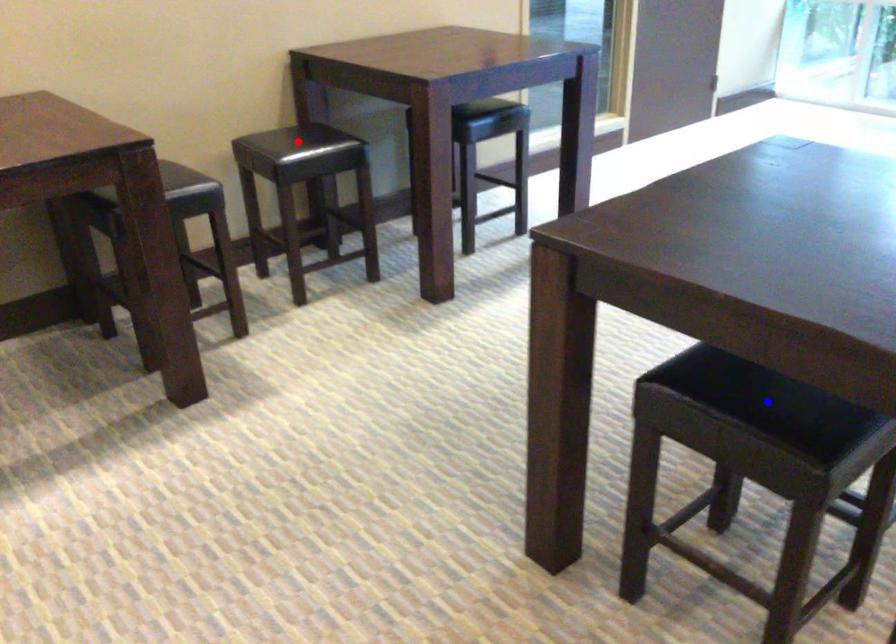
Question: Two points are marked on the image. Which point is closer to the camera?

Choices:
 (A) Blue point is closer.
 (B) Red point is closer.

Answer: (A)